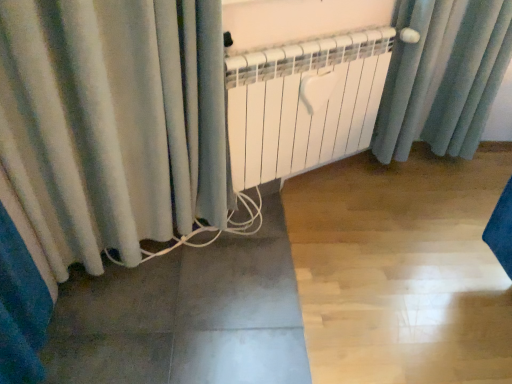
Question: From a real-world perspective, is velvet curtain at lower left above or below white matte radiator at center?

Choices:
 (A) below
 (B) above

Answer: (B)

Question: In the image, is velvet curtain at lower left positioned in front of or behind white matte radiator at center?

Choices:
 (A) front
 (B) behind

Answer: (A)

Question: Is point (163, 89) closer or farther from the camera than point (254, 79)?

Choices:
 (A) closer
 (B) farther

Answer: (A)

Question: From a real-world perspective, is white matte radiator at center above or below velvet curtain at lower left?

Choices:
 (A) below
 (B) above

Answer: (A)

Question: Visually, is white matte radiator at center positioned to the left or to the right of velvet curtain at lower left?

Choices:
 (A) right
 (B) left

Answer: (A)

Question: In terms of size, does white matte radiator at center appear bigger or smaller than velvet curtain at lower left?

Choices:
 (A) big
 (B) small

Answer: (B)

Question: From the image's perspective, is white matte radiator at center located above or below velvet curtain at lower left?

Choices:
 (A) below
 (B) above

Answer: (B)